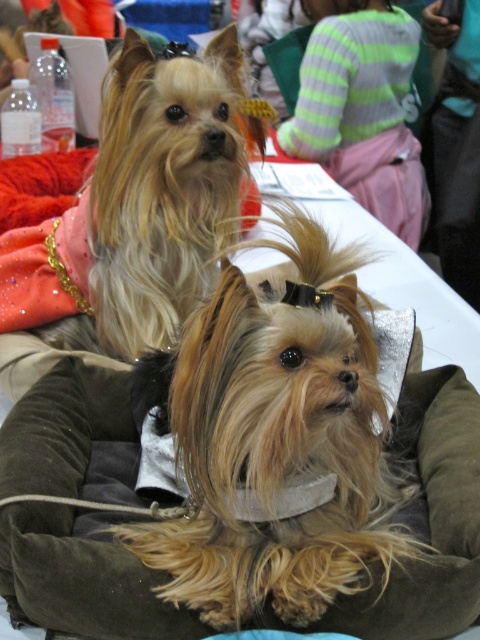
Question: Among these objects, which one is nearest to the camera?

Choices:
 (A) shiny blonde fur at center
 (B) shiny golden fur at center
 (C) brown suede dog bed at center

Answer: (B)

Question: Among these objects, which one is farthest from the camera?

Choices:
 (A) brown suede dog bed at center
 (B) shiny golden fur at center

Answer: (A)

Question: Among these points, which one is farthest from the camera?

Choices:
 (A) (0, 291)
 (B) (243, 544)

Answer: (A)

Question: Can you confirm if shiny golden fur at center is positioned to the right of shiny blonde fur at center?

Choices:
 (A) no
 (B) yes

Answer: (B)

Question: Observing the image, what is the correct spatial positioning of shiny blonde fur at center in reference to brown suede dog bed at center?

Choices:
 (A) below
 (B) above

Answer: (B)

Question: Is shiny golden fur at center to the left of brown suede dog bed at center from the viewer's perspective?

Choices:
 (A) no
 (B) yes

Answer: (A)